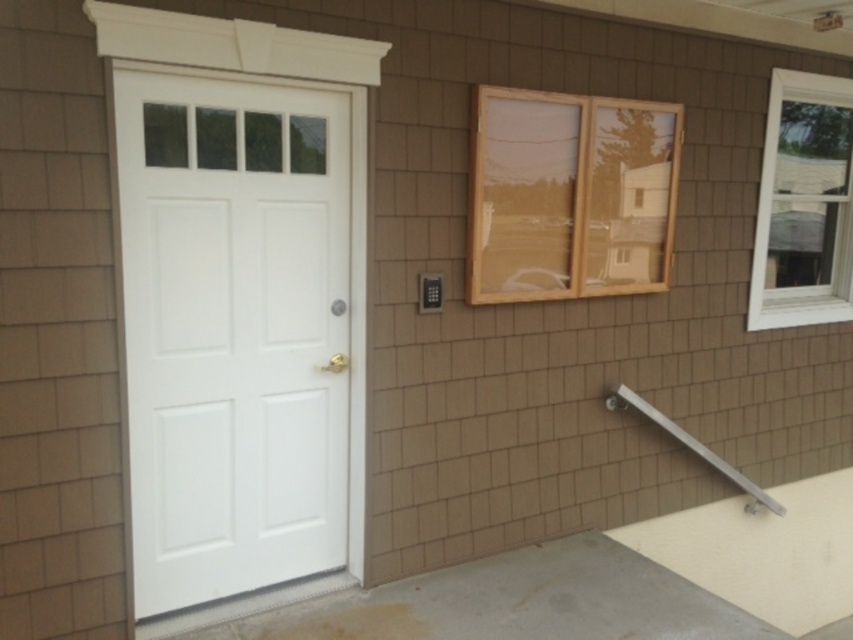
Question: Does white painted wood screen door at left appear over clear glass window at center?

Choices:
 (A) no
 (B) yes

Answer: (A)

Question: Is white painted wood screen door at left above silver metallic handrail at lower right?

Choices:
 (A) no
 (B) yes

Answer: (B)

Question: Is white painted wood screen door at left above clear glass window at center?

Choices:
 (A) yes
 (B) no

Answer: (B)

Question: Which is nearer to the white plastic window at upper right?

Choices:
 (A) clear glass window at center
 (B) silver metallic handrail at lower right

Answer: (A)

Question: Estimate the real-world distances between objects in this image. Which object is farther from the silver metallic handrail at lower right?

Choices:
 (A) white painted wood screen door at left
 (B) white plastic window at upper right
 (C) clear glass window at center

Answer: (A)

Question: Which of the following is the closest to the observer?

Choices:
 (A) white plastic window at upper right
 (B) clear glass window at center
 (C) white painted wood screen door at left

Answer: (C)